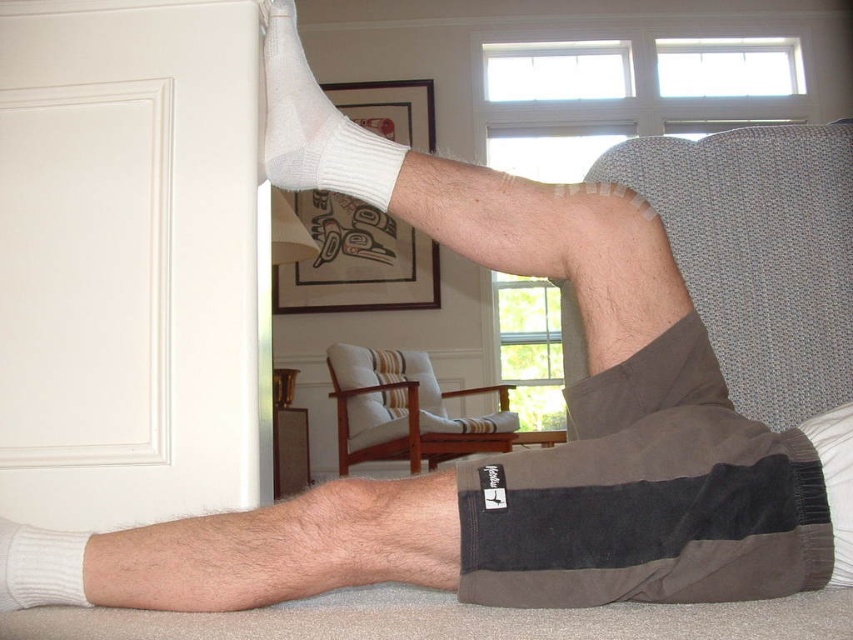
Question: In this image, where is white cotton sock at upper left located relative to white knitted sock at lower left?

Choices:
 (A) left
 (B) right

Answer: (B)

Question: Which point is closer to the camera?

Choices:
 (A) (281, 68)
 (B) (26, 528)

Answer: (B)

Question: Does white cotton sock at upper left appear on the right side of white knitted sock at lower left?

Choices:
 (A) no
 (B) yes

Answer: (B)

Question: Where is white cotton sock at upper left located in relation to white knitted sock at lower left in the image?

Choices:
 (A) above
 (B) below

Answer: (A)